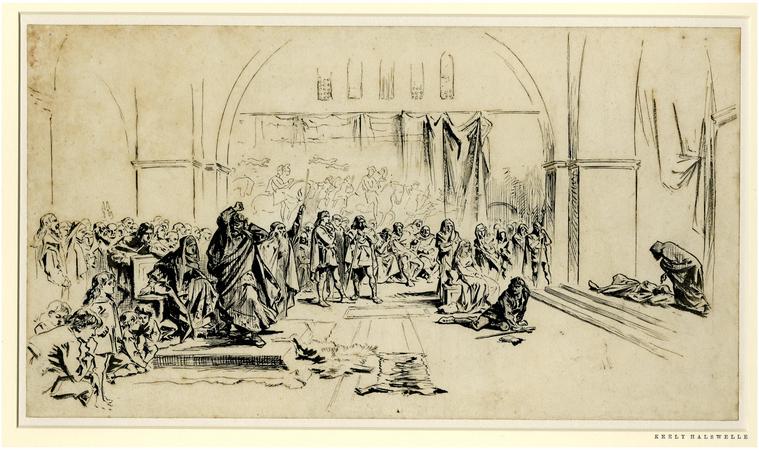
This screenshot has width=759, height=450. What are the coordinates of `artwork` in the screenshot? It's located at (616, 320).